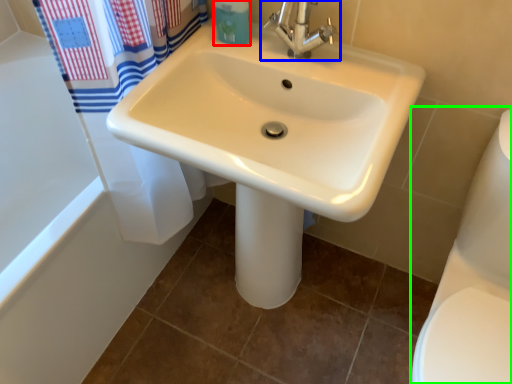
Question: Which object is the farthest from toiletry (highlighted by a red box)? Choose among these: tap (highlighted by a blue box) or toilet bowl (highlighted by a green box).

Choices:
 (A) tap
 (B) toilet bowl

Answer: (B)